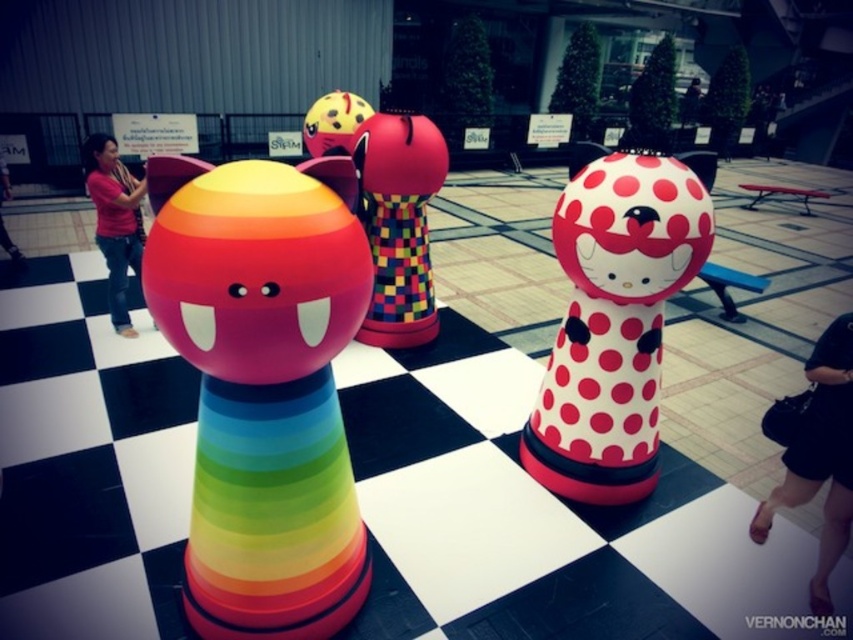
Between black leather shoes at lower right and pink fabric person at left, which one is positioned lower?

Positioned lower is black leather shoes at lower right.

This screenshot has width=853, height=640. Find the location of `black leather shoes at lower right`. black leather shoes at lower right is located at coordinates (819, 456).

You are a GUI agent. You are given a task and a screenshot of the screen. Output one action in this format:
    pyautogui.click(x=<x>, y=<y>)
    Task: Click on the black leather shoes at lower right
    This screenshot has height=640, width=853.
    Given the screenshot: What is the action you would take?
    pyautogui.click(x=819, y=456)

Is point (703, 186) in front of point (112, 310)?

Yes, point (703, 186) is closer to viewer.

Which is more to the right, white glossy hello kitty doll at center or pink fabric shirt at left?

white glossy hello kitty doll at center is more to the right.

Who is more distant from viewer, (677,250) or (111,248)?

The point (111,248) is behind.

Identify the location of white glossy hello kitty doll at center. The height and width of the screenshot is (640, 853). (614, 323).

Is point (421, 211) farther from camera compared to point (126, 172)?

Yes, it is behind point (126, 172).

Identify the location of matte rainbow cone at center. The height and width of the screenshot is (640, 853). (398, 224).